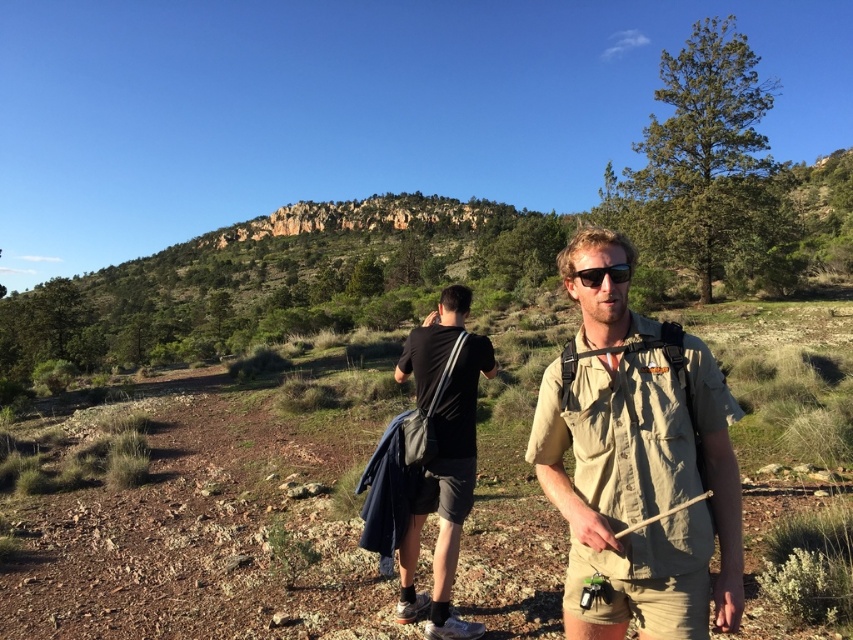
Is point (415, 484) closer to viewer compared to point (628, 273)?

No, it is behind (628, 273).

Image resolution: width=853 pixels, height=640 pixels. I want to click on black matte shirt at center, so click(445, 493).

In order to click on black matte shirt at center in this screenshot , I will do `click(445, 493)`.

Does point (593, 259) come closer to viewer compared to point (440, 531)?

That is True.

This screenshot has height=640, width=853. What do you see at coordinates (637, 461) in the screenshot?
I see `tan canvas backpack at center` at bounding box center [637, 461].

You are a GUI agent. You are given a task and a screenshot of the screen. Output one action in this format:
    pyautogui.click(x=<x>, y=<y>)
    Task: Click on the tan canvas backpack at center
    The width and height of the screenshot is (853, 640).
    Given the screenshot: What is the action you would take?
    pyautogui.click(x=637, y=461)

Which is above, tan canvas backpack at center or matte black sunglasses at center?

matte black sunglasses at center is higher up.

Can you confirm if tan canvas backpack at center is wider than matte black sunglasses at center?

Indeed, tan canvas backpack at center has a greater width compared to matte black sunglasses at center.

At what (x,y) coordinates should I click in order to perform the action: click on tan canvas backpack at center. Please return your answer as a coordinate pair (x, y). The width and height of the screenshot is (853, 640). Looking at the image, I should click on click(637, 461).